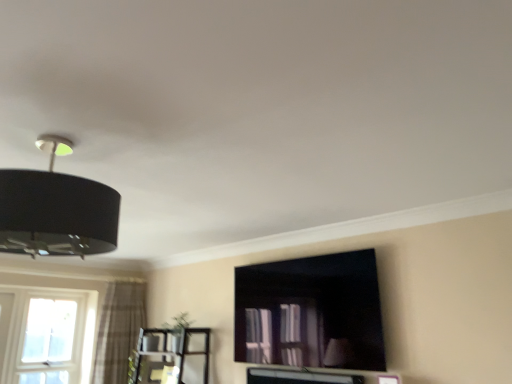
Question: Is plaid fabric curtain at left beside clear glass window at lower left?

Choices:
 (A) no
 (B) yes

Answer: (A)

Question: Is the depth of plaid fabric curtain at left greater than that of clear glass window at lower left?

Choices:
 (A) no
 (B) yes

Answer: (B)

Question: Is plaid fabric curtain at left not close to clear glass window at lower left?

Choices:
 (A) yes
 (B) no

Answer: (B)

Question: From the image's perspective, is plaid fabric curtain at left located beneath clear glass window at lower left?

Choices:
 (A) no
 (B) yes

Answer: (A)

Question: From a real-world perspective, is plaid fabric curtain at left below clear glass window at lower left?

Choices:
 (A) no
 (B) yes

Answer: (A)

Question: In the image, is metallic silver entertainment center at lower left positioned in front of or behind plaid fabric curtain at left?

Choices:
 (A) behind
 (B) front

Answer: (B)

Question: From their relative heights in the image, would you say metallic silver entertainment center at lower left is taller or shorter than plaid fabric curtain at left?

Choices:
 (A) short
 (B) tall

Answer: (A)

Question: Is metallic silver entertainment center at lower left inside the boundaries of plaid fabric curtain at left, or outside?

Choices:
 (A) outside
 (B) inside

Answer: (A)

Question: From the image's perspective, is metallic silver entertainment center at lower left located above or below plaid fabric curtain at left?

Choices:
 (A) above
 (B) below

Answer: (B)

Question: Relative to matte black tv cabinet at center, is plaid fabric curtain at left in front or behind?

Choices:
 (A) behind
 (B) front

Answer: (A)

Question: Is plaid fabric curtain at left to the left or to the right of matte black tv cabinet at center in the image?

Choices:
 (A) right
 (B) left

Answer: (B)

Question: From the image's perspective, is plaid fabric curtain at left located above or below matte black tv cabinet at center?

Choices:
 (A) below
 (B) above

Answer: (A)

Question: Do you think plaid fabric curtain at left is within matte black tv cabinet at center, or outside of it?

Choices:
 (A) inside
 (B) outside

Answer: (B)

Question: Is black matte lampshade at upper left wider or thinner than metallic silver entertainment center at lower left?

Choices:
 (A) wide
 (B) thin

Answer: (A)

Question: Visually, is black matte lampshade at upper left positioned to the left or to the right of metallic silver entertainment center at lower left?

Choices:
 (A) right
 (B) left

Answer: (A)